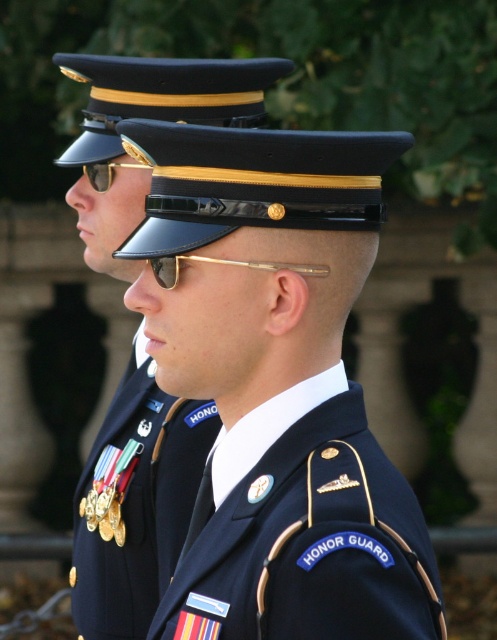
You are a photographer at an event and need to capture both the navy blue fabric uniform at center and the navy blue uniform at center in a single frame. Which of the two uniforms should you adjust to ensure both are fully visible?

The navy blue fabric uniform at center has a lesser height compared to navy blue uniform at center. Therefore, you should adjust the position of the navy blue fabric uniform at center to ensure both are fully visible.

From the picture: You are a photographer positioned at the center of the scene. You need to capture a closeup shot of the navy blue fabric uniform at center. Based on its position, is it within your camera frame that covers the central 50x50 pixel area?

The navy blue fabric uniform at center is located at point (x=305, y=531), which falls within the central 50x50 pixel area of the frame. Therefore, it will be captured in the closeup shot.

You are a photographer trying to capture the details of the gold metallic medals at center and the gold reflective sunglasses at upper center. Since you want to ensure both are visible in the photo, which object should you focus on first to avoid blurring due to their size differences?

The gold metallic medals at center are larger than the gold reflective sunglasses at upper center. Therefore, you should focus on the gold metallic medals at center first, as their larger size requires more precise focus to capture all details clearly.